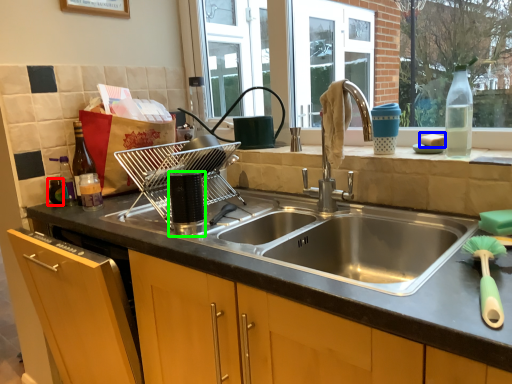
Question: Estimate the real-world distances between objects in this image. Which object is closer to bottle (highlighted by a red box), food (highlighted by a blue box) or appliance (highlighted by a green box)?

Choices:
 (A) food
 (B) appliance

Answer: (B)